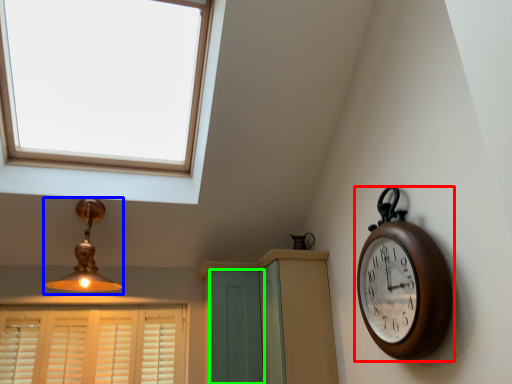
Question: Which is nearer to the wall clock (highlighted by a red box)? lamp (highlighted by a blue box) or screen door (highlighted by a green box).

Choices:
 (A) lamp
 (B) screen door

Answer: (B)